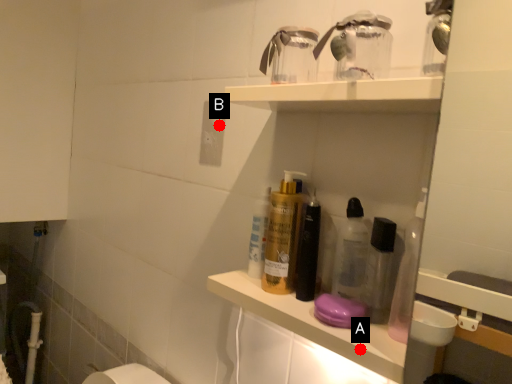
Question: Two points are circled on the image, labeled by A and B beside each circle. Which point appears farthest from the camera in this image?

Choices:
 (A) A is further
 (B) B is further

Answer: (B)